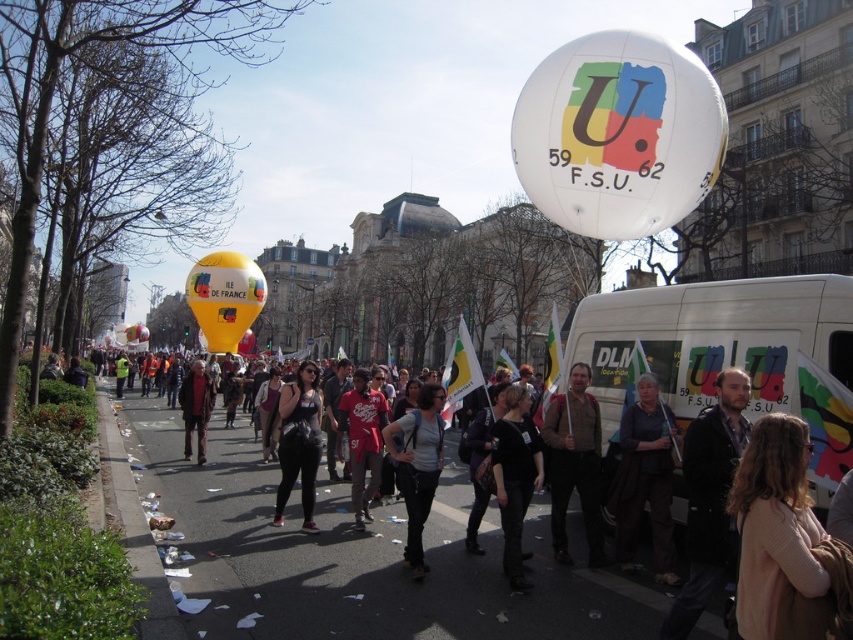
Does brown leather jacket at center come in front of yellowballoon at left?

Yes, brown leather jacket at center is in front of yellowballoon at left.

Is brown leather jacket at center below yellowballoon at left?

Yes.

Does point (576, 452) come in front of point (138, 330)?

Yes, point (576, 452) is closer to viewer.

Image resolution: width=853 pixels, height=640 pixels. I want to click on brown leather jacket at center, so click(573, 464).

Is point (306, 435) less distant than point (376, 483)?

Yes, it is.

Is black leather pants at center to the left of red cotton shirt at center from the viewer's perspective?

Correct, you'll find black leather pants at center to the left of red cotton shirt at center.

Is point (297, 472) positioned after point (352, 422)?

No, it is not.

Find the location of a particular element. This screenshot has height=640, width=853. black leather pants at center is located at coordinates (299, 442).

Is black matte pants at center above yellowballoon at left?

Actually, black matte pants at center is below yellowballoon at left.

Describe the element at coordinates (515, 476) in the screenshot. I see `black matte pants at center` at that location.

The width and height of the screenshot is (853, 640). I want to click on black matte pants at center, so click(515, 476).